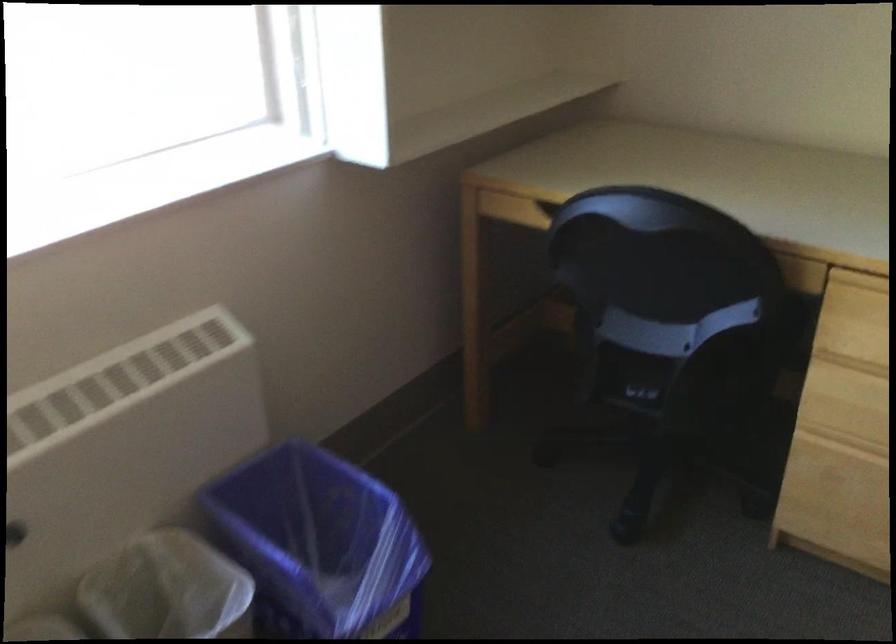
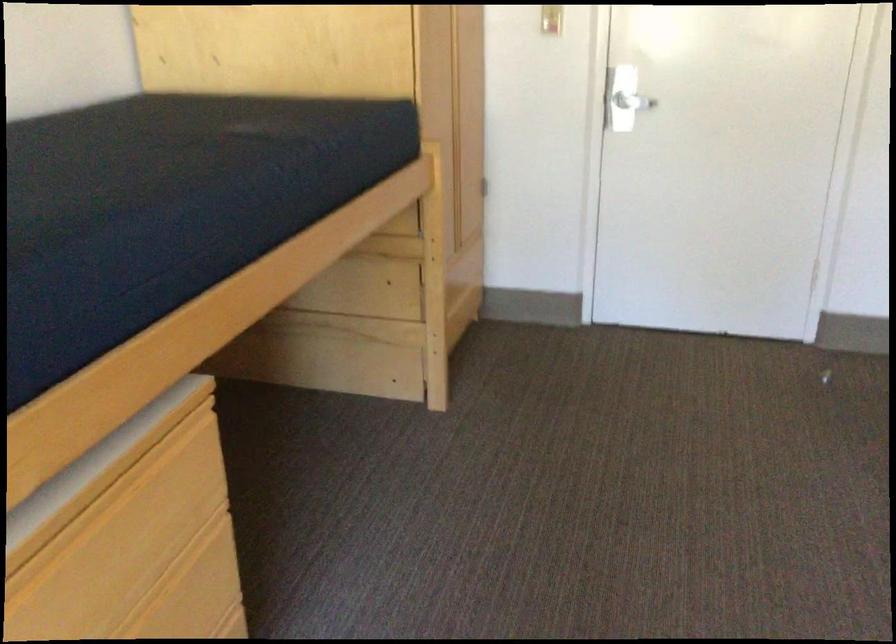
Based on the continuous images, in which direction is the camera rotating?

The camera's rotation is toward right-down.